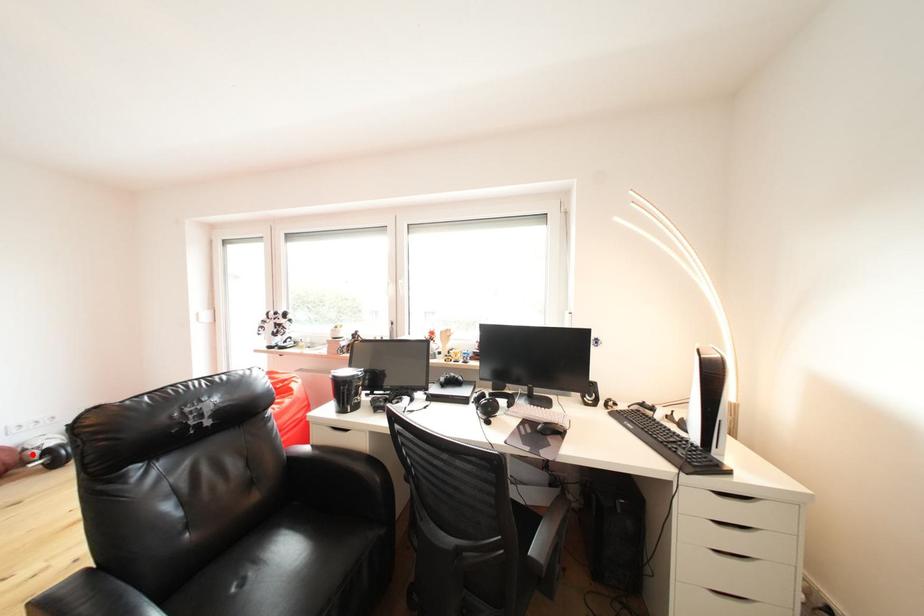
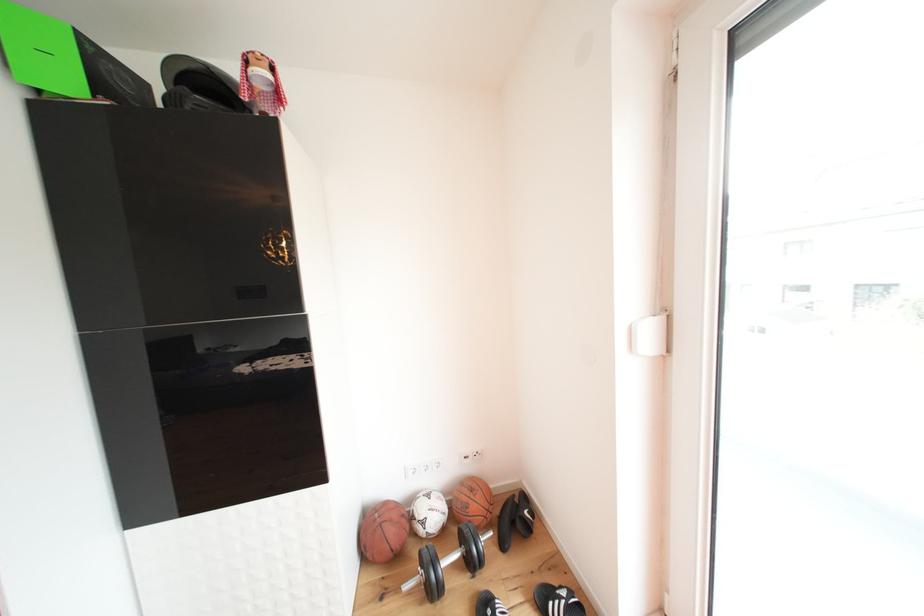
Question: I am providing you with two images of the same scene from different viewpoints. Given a red point in image1, look at the same physical point in image2. Is it:

Choices:
 (A) Closer to the viewpoint
 (B) Farther from the viewpoint

Answer: (B)